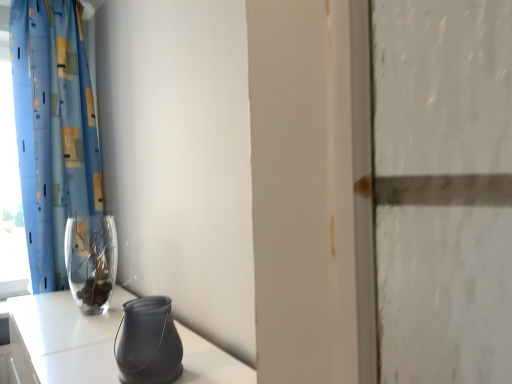
Find the location of a particular element. transparent glass window at left is located at coordinates (10, 189).

In order to face blue printed fabric curtain at left, should I rotate leftwards or rightwards?

You should look left and rotate roughly 24.436 degrees.

This screenshot has width=512, height=384. What do you see at coordinates (148, 343) in the screenshot?
I see `matte black vase at lower center, the 1th vase in the front-to-back sequence` at bounding box center [148, 343].

You are a GUI agent. You are given a task and a screenshot of the screen. Output one action in this format:
    pyautogui.click(x=<x>, y=<y>)
    Task: Click on the transparent glass window at left
    
    Given the screenshot: What is the action you would take?
    pyautogui.click(x=10, y=189)

Is transparent glass window at left closer to the viewer compared to transparent glass vase at left, the 1th vase from the back?

That is False.

From a real-world perspective, who is located higher, transparent glass window at left or transparent glass vase at left, the second vase in the right-to-left sequence?

From a 3D spatial view, transparent glass window at left is above.

Would you say transparent glass window at left is to the left or to the right of transparent glass vase at left, the 1th vase from the back, in the picture?

transparent glass window at left is positioned on transparent glass vase at left, the 1th vase from the back,'s left side.

Which is closer, (17,220) or (102,271)?

Point (102,271)

Between transparent glass vase at left, the 1th vase from the back, and matte black vase at lower center, which appears as the second vase when viewed from the left, which one has more height?

Standing taller between the two is transparent glass vase at left, the 1th vase from the back.

Between point (106, 261) and point (118, 362), which one is positioned in front?

The point (118, 362) is closer.

Is transparent glass vase at left, which is the second vase from front to back, to the left or to the right of matte black vase at lower center, the 1th vase in the front-to-back sequence, in the image?

transparent glass vase at left, which is the second vase from front to back, is positioned on matte black vase at lower center, the 1th vase in the front-to-back sequence,'s left side.

Would you say blue printed fabric curtain at left contains transparent glass vase at left, which is the second vase from front to back?

That's incorrect, transparent glass vase at left, which is the second vase from front to back, is not inside blue printed fabric curtain at left.

Is blue printed fabric curtain at left in front of transparent glass vase at left, the 1th vase from the back?

No, the depth of blue printed fabric curtain at left is greater than that of transparent glass vase at left, the 1th vase from the back.

Is the surface of blue printed fabric curtain at left in direct contact with transparent glass vase at left, the second vase in the right-to-left sequence?

No, blue printed fabric curtain at left is not touching transparent glass vase at left, the second vase in the right-to-left sequence.

From the picture: How far apart are blue printed fabric curtain at left and transparent glass vase at left, the 1th vase from the back?

blue printed fabric curtain at left and transparent glass vase at left, the 1th vase from the back, are 16.82 inches apart from each other.

Is point (17, 58) closer to viewer compared to point (18, 169)?

Yes.

Consider the image. Is blue printed fabric curtain at left to the left of transparent glass window at left from the viewer's perspective?

No, blue printed fabric curtain at left is not to the left of transparent glass window at left.

From a real-world perspective, does blue printed fabric curtain at left stand above transparent glass window at left?

Correct, in the physical world, blue printed fabric curtain at left is higher than transparent glass window at left.

Does transparent glass window at left have a greater height compared to blue printed fabric curtain at left?

In fact, transparent glass window at left may be shorter than blue printed fabric curtain at left.

Does transparent glass window at left have a lesser width compared to blue printed fabric curtain at left?

Yes, transparent glass window at left is thinner than blue printed fabric curtain at left.

Is point (29, 278) in front of point (79, 191)?

No.

Which object is positioned more to the left, transparent glass window at left or blue printed fabric curtain at left?

Positioned to the left is transparent glass window at left.

From a real-world perspective, who is located higher, transparent glass vase at left, the 1th vase from the back, or transparent glass window at left?

transparent glass window at left, from a real-world perspective.

Based on their sizes in the image, would you say transparent glass vase at left, the 1th vase in the left-to-right sequence, is bigger or smaller than transparent glass window at left?

Clearly, transparent glass vase at left, the 1th vase in the left-to-right sequence, is smaller in size than transparent glass window at left.

Considering the relative positions of transparent glass vase at left, the 1th vase from the back, and transparent glass window at left in the image provided, is transparent glass vase at left, the 1th vase from the back, to the left of transparent glass window at left from the viewer's perspective?

Incorrect, transparent glass vase at left, the 1th vase from the back, is not on the left side of transparent glass window at left.

Is transparent glass vase at left, the 1th vase from the back, beside transparent glass window at left?

There is a gap between transparent glass vase at left, the 1th vase from the back, and transparent glass window at left.

Is matte black vase at lower center, the 1th vase in the front-to-back sequence, looking in the opposite direction of blue printed fabric curtain at left?

matte black vase at lower center, the 1th vase in the front-to-back sequence, does not have its back to blue printed fabric curtain at left.

You are a GUI agent. You are given a task and a screenshot of the screen. Output one action in this format:
    pyautogui.click(x=<x>, y=<y>)
    Task: Click on the curtain behind the matte black vase at lower center, which is counted as the first vase, starting from the right
    Image resolution: width=512 pixels, height=384 pixels.
    Given the screenshot: What is the action you would take?
    pyautogui.click(x=53, y=130)

Who is more distant, matte black vase at lower center, positioned as the 2th vase in back-to-front order, or blue printed fabric curtain at left?

blue printed fabric curtain at left is more distant.

Find the location of a particular element. The width and height of the screenshot is (512, 384). the 1st vase below the transparent glass window at left (from a real-world perspective) is located at coordinates (91, 261).

Identify the location of vase that is in front of the transparent glass vase at left, the 1th vase from the back. (148, 343).

When comparing their distances from blue printed fabric curtain at left, does transparent glass vase at left, which is the second vase from front to back, or transparent glass window at left seem closer?

Based on the image, transparent glass window at left appears to be nearer to blue printed fabric curtain at left.

Considering their positions, is transparent glass vase at left, the 1th vase from the back, positioned closer to transparent glass window at left than matte black vase at lower center, the 1th vase in the front-to-back sequence?

transparent glass vase at left, the 1th vase from the back, is positioned closer to the anchor transparent glass window at left.

When comparing their distances from blue printed fabric curtain at left, does transparent glass window at left or transparent glass vase at left, which is the second vase from front to back, seem closer?

transparent glass window at left is positioned closer to the anchor blue printed fabric curtain at left.

From the image, which object appears to be nearer to matte black vase at lower center, the 1th vase in the front-to-back sequence, transparent glass window at left or blue printed fabric curtain at left?

blue printed fabric curtain at left is positioned closer to the anchor matte black vase at lower center, the 1th vase in the front-to-back sequence.

Which object lies nearer to the anchor point transparent glass vase at left, the 1th vase from the back, matte black vase at lower center, which is counted as the first vase, starting from the right, or blue printed fabric curtain at left?

blue printed fabric curtain at left.

From the image, which object appears to be nearer to transparent glass window at left, transparent glass vase at left, the 1th vase in the left-to-right sequence, or blue printed fabric curtain at left?

The object closer to transparent glass window at left is blue printed fabric curtain at left.

Which object lies nearer to the anchor point transparent glass vase at left, which is the second vase from front to back, transparent glass window at left or blue printed fabric curtain at left?

The object closer to transparent glass vase at left, which is the second vase from front to back, is blue printed fabric curtain at left.

From the image, which object appears to be nearer to transparent glass window at left, blue printed fabric curtain at left or transparent glass vase at left, the 1th vase in the left-to-right sequence?

blue printed fabric curtain at left lies closer to transparent glass window at left than the other object.

You are a GUI agent. You are given a task and a screenshot of the screen. Output one action in this format:
    pyautogui.click(x=<x>, y=<y>)
    Task: Click on the vase between matte black vase at lower center, positioned as the 2th vase in back-to-front order, and transparent glass window at left in the front-back direction
    
    Given the screenshot: What is the action you would take?
    pyautogui.click(x=91, y=261)

Where is `curtain between matte black vase at lower center, positioned as the 2th vase in back-to-front order, and transparent glass window at left in the front-back direction`? The height and width of the screenshot is (384, 512). curtain between matte black vase at lower center, positioned as the 2th vase in back-to-front order, and transparent glass window at left in the front-back direction is located at coordinates (53, 130).

The height and width of the screenshot is (384, 512). What are the coordinates of `curtain between transparent glass window at left and transparent glass vase at left, the 1th vase from the back` in the screenshot? It's located at (53, 130).

Identify the location of vase located between matte black vase at lower center, the 1th vase in the front-to-back sequence, and blue printed fabric curtain at left in the depth direction. The image size is (512, 384). (91, 261).